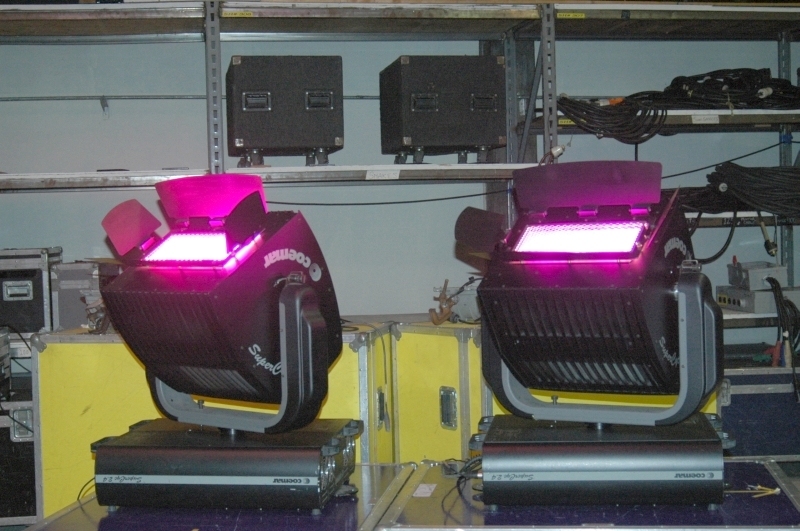
This screenshot has height=531, width=800. Find the location of `sticker`. sticker is located at coordinates (568, 12), (565, 123), (237, 12), (706, 121), (378, 172), (422, 488).